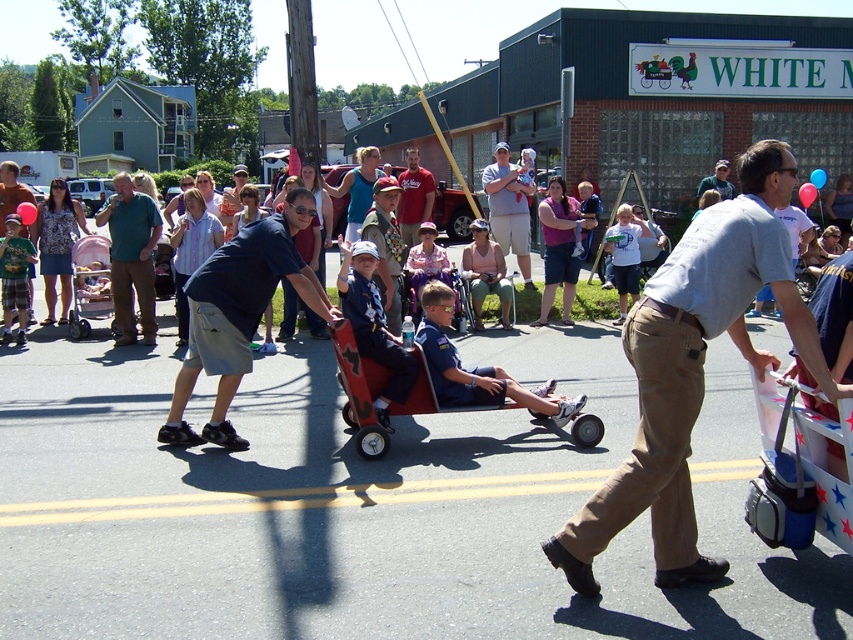
Who is lower down, khaki pants at center or dark blue shorts at center?

khaki pants at center

Is khaki pants at center further to camera compared to dark blue shorts at center?

That is False.

Where is `khaki pants at center`? Image resolution: width=853 pixels, height=640 pixels. khaki pants at center is located at coordinates (693, 369).

Is point (442, 305) closer to viewer compared to point (715, 182)?

That is True.

Is blue denim shorts at center bigger than green fabric cap at center?

No, blue denim shorts at center is not bigger than green fabric cap at center.

Between point (550, 412) and point (723, 193), which one is positioned behind?

The point (723, 193) is more distant.

I want to click on blue denim shorts at center, so click(474, 368).

Consider the image. Who is shorter, wooden cart at center or green matte shirt at center?

wooden cart at center

Who is more forward, (437,401) or (152,227)?

Point (437,401) is in front.

This screenshot has width=853, height=640. Find the location of `wooden cart at center`. wooden cart at center is located at coordinates (360, 392).